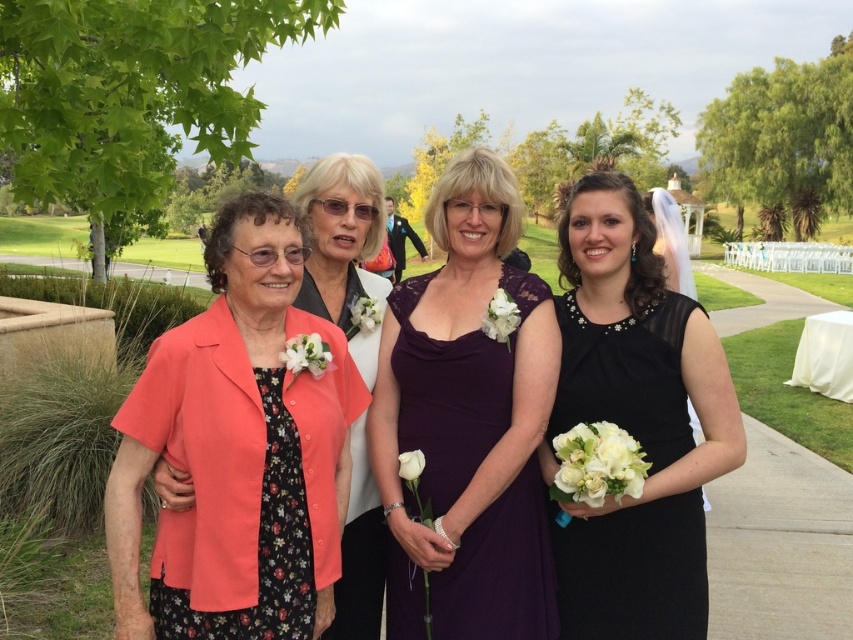
You are a photographer trying to capture a portrait of the two women in the image. The black satin dress at right and the matte coral blouse at center are important elements to highlight. Based on their positions, which woman should you focus on first to ensure both are in frame?

The black satin dress at right is below the matte coral blouse at center, so you should focus on the woman in the matte coral blouse at center first to ensure both are in frame.

You are a photographer at the wedding and want to ensure all guests can see the couple during the ceremony. The matte coral cardigan at left and black satin dress at right are part of the front row. Given their heights, which guest should be positioned closer to the front to ensure visibility?

The matte coral cardigan at left is much taller than the black satin dress at right, so the guest wearing the black satin dress at right should be positioned closer to the front to ensure visibility for those behind.

You are a photographer at a wedding and need to arrange the two women in the image so that their dresses do not overlap. The black satin dress at right and the purple lace dress at center are currently positioned as described. Which dress should be moved to the left to avoid overlapping?

The black satin dress at right should be moved to the left because it is thinner than the purple lace dress at center, so it requires less space and can be positioned closer without overlapping.